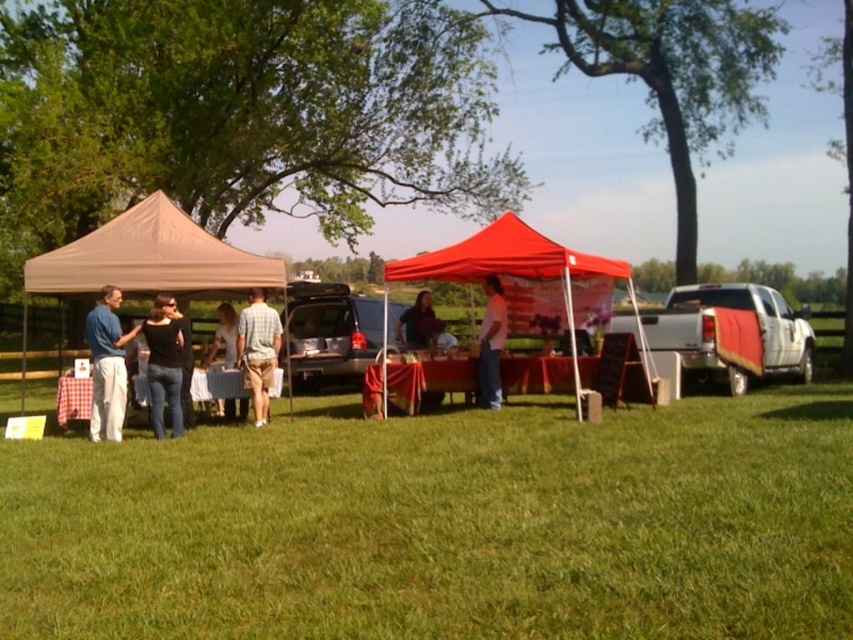
Question: Estimate the real-world distances between objects in this image. Which object is closer to the blue fabric shirt at left?

Choices:
 (A) white cotton shirt at center
 (B) beige fabric canopy at left
 (C) white matte truck at right

Answer: (B)

Question: Which object is farther from the camera taking this photo?

Choices:
 (A) beige fabric canopy at left
 (B) matte red canopy at center

Answer: (A)

Question: Does blue fabric shirt at left appear on the left side of black matte shirt at center?

Choices:
 (A) yes
 (B) no

Answer: (A)

Question: Which point is closer to the camera?

Choices:
 (A) (747, 369)
 (B) (97, 332)
 (C) (152, 307)
 (D) (202, 260)

Answer: (B)

Question: Is tan fabric tent at left above matte red canopy at center?

Choices:
 (A) yes
 (B) no

Answer: (B)

Question: Observing the image, what is the correct spatial positioning of plaid shirt at center in reference to white cotton shirt at center?

Choices:
 (A) left
 (B) right

Answer: (A)